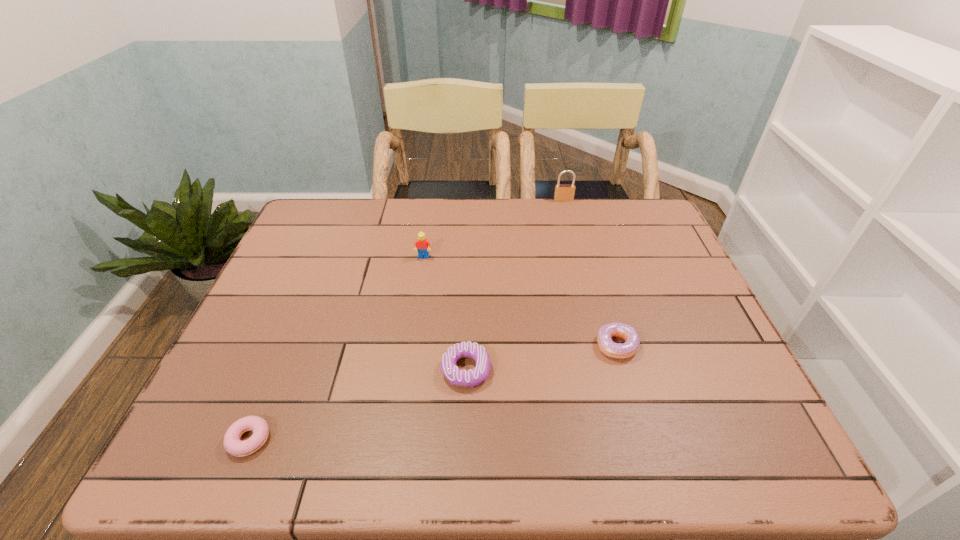
Find the location of a particular element. the tallest object is located at coordinates (563, 192).

Find the location of `the farthest object`. the farthest object is located at coordinates (563, 192).

This screenshot has height=540, width=960. Find the location of `the second object from left to right`. the second object from left to right is located at coordinates (422, 244).

This screenshot has height=540, width=960. I want to click on the second farthest object, so click(x=422, y=244).

I want to click on the second doughnut from right to left, so click(461, 378).

The height and width of the screenshot is (540, 960). I want to click on the rightmost doughnut, so click(625, 350).

The width and height of the screenshot is (960, 540). Identify the location of the nearest object. (233, 445).

Find the location of a particular element. This screenshot has height=540, width=960. the leftmost doughnut is located at coordinates (233, 445).

Find the location of a particular element. This screenshot has height=540, width=960. vacant space situated on the front-facing side of the padlock is located at coordinates pos(582,272).

I want to click on free point located on the face of the fourth object from right to left, so click(x=417, y=306).